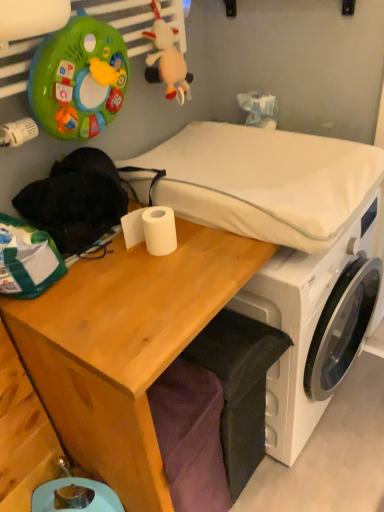
Question: Can you confirm if white fabric mattress at center is smaller than white plastic washing machine at center?

Choices:
 (A) no
 (B) yes

Answer: (B)

Question: Does white fabric mattress at center touch white plastic washing machine at center?

Choices:
 (A) no
 (B) yes

Answer: (A)

Question: Is white fabric mattress at center positioned behind white plastic washing machine at center?

Choices:
 (A) yes
 (B) no

Answer: (B)

Question: From a real-world perspective, does white fabric mattress at center sit lower than white plastic washing machine at center?

Choices:
 (A) no
 (B) yes

Answer: (A)

Question: Does white fabric mattress at center turn towards white plastic washing machine at center?

Choices:
 (A) no
 (B) yes

Answer: (A)

Question: From the image's perspective, is white fabric mattress at center located beneath white plastic washing machine at center?

Choices:
 (A) yes
 (B) no

Answer: (B)

Question: Considering the relative sizes of white matte toilet paper at center and white fabric mattress at center in the image provided, is white matte toilet paper at center thinner than white fabric mattress at center?

Choices:
 (A) no
 (B) yes

Answer: (B)

Question: Is white matte toilet paper at center in front of white fabric mattress at center?

Choices:
 (A) yes
 (B) no

Answer: (B)

Question: Is white matte toilet paper at center not close to white fabric mattress at center?

Choices:
 (A) yes
 (B) no

Answer: (B)

Question: Considering the relative sizes of white matte toilet paper at center and white fabric mattress at center in the image provided, is white matte toilet paper at center wider than white fabric mattress at center?

Choices:
 (A) no
 (B) yes

Answer: (A)

Question: From a real-world perspective, does white matte toilet paper at center stand above white fabric mattress at center?

Choices:
 (A) yes
 (B) no

Answer: (B)

Question: Considering the relative sizes of white matte toilet paper at center and white fabric mattress at center in the image provided, is white matte toilet paper at center taller than white fabric mattress at center?

Choices:
 (A) no
 (B) yes

Answer: (A)

Question: Considering the relative sizes of white matte toilet paper at center and white plastic washing machine at center in the image provided, is white matte toilet paper at center smaller than white plastic washing machine at center?

Choices:
 (A) no
 (B) yes

Answer: (B)